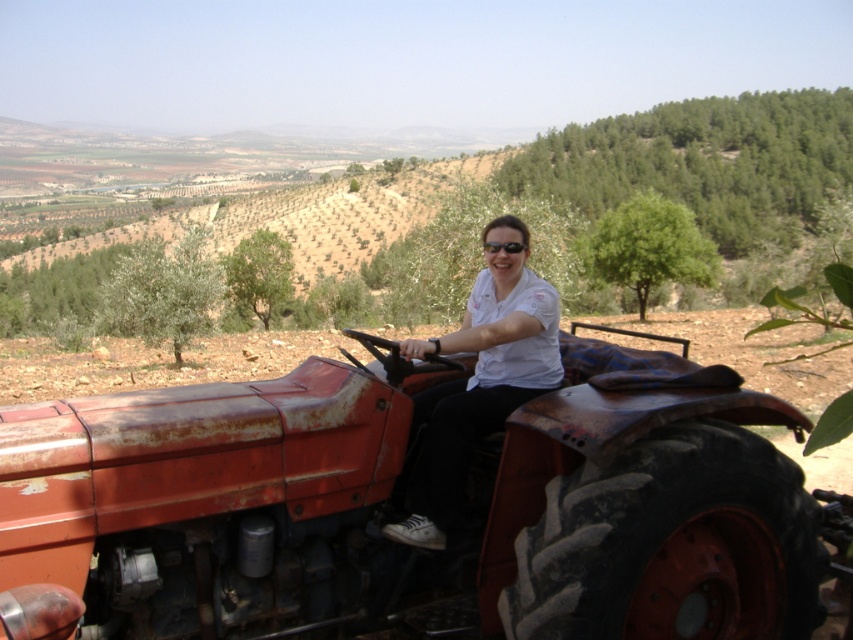
Question: Estimate the real-world distances between objects in this image. Which object is closer to the white matte shirt at center?

Choices:
 (A) black plastic sunglasses at center
 (B) rusty metal tractor at center

Answer: (B)

Question: Which of the following is the closest to the observer?

Choices:
 (A) white matte shirt at center
 (B) black plastic sunglasses at center
 (C) rusty metal tractor at center

Answer: (C)

Question: Is rusty metal tractor at center to the right of black plastic sunglasses at center from the viewer's perspective?

Choices:
 (A) yes
 (B) no

Answer: (B)

Question: Which of the following is the farthest from the observer?

Choices:
 (A) white matte shirt at center
 (B) black plastic sunglasses at center

Answer: (B)

Question: From the image, what is the correct spatial relationship of white matte shirt at center in relation to black plastic sunglasses at center?

Choices:
 (A) below
 (B) above

Answer: (A)

Question: Is rusty metal tractor at center bigger than black plastic sunglasses at center?

Choices:
 (A) no
 (B) yes

Answer: (B)